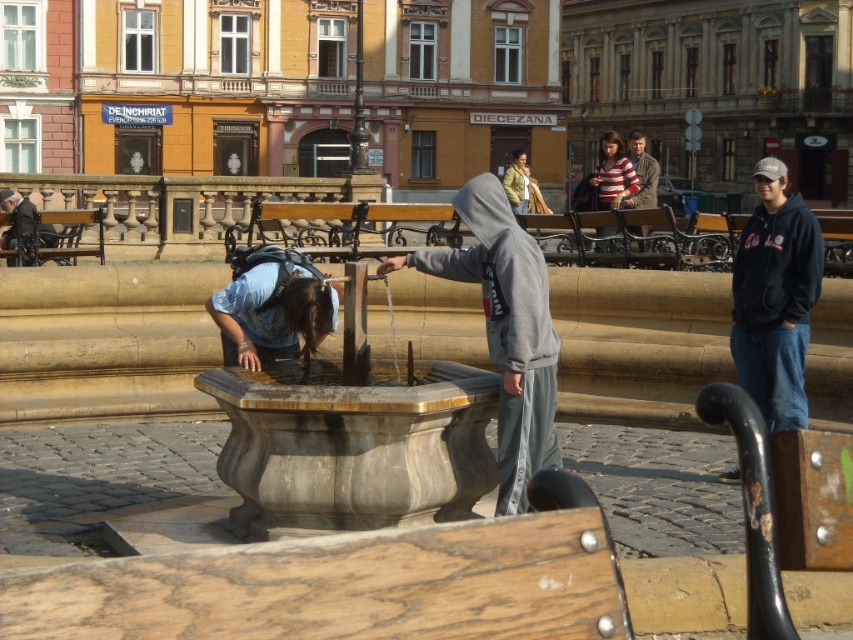
Can you confirm if dark blue hoodie at right is taller than striped cotton shirt at center?

No, dark blue hoodie at right is not taller than striped cotton shirt at center.

Is dark blue hoodie at right thinner than striped cotton shirt at center?

Correct, dark blue hoodie at right's width is less than striped cotton shirt at center's.

Between point (740, 381) and point (621, 147), which one is positioned in front?

Point (740, 381)

The width and height of the screenshot is (853, 640). In order to click on dark blue hoodie at right in this screenshot , I will do `click(775, 298)`.

Who is lower down, striped cotton shirt at center or striped sweater at center?

striped sweater at center is below.

The width and height of the screenshot is (853, 640). In order to click on striped cotton shirt at center in this screenshot , I will do `click(612, 173)`.

Find the location of a particular element. striped cotton shirt at center is located at coordinates (612, 173).

Between gray hoodie at center and dark blue hoodie at right, which one has more height?

dark blue hoodie at right is taller.

Which is behind, point (515, 355) or point (737, 472)?

The point (737, 472) is more distant.

Describe the element at coordinates (506, 330) in the screenshot. The height and width of the screenshot is (640, 853). I see `gray hoodie at center` at that location.

Image resolution: width=853 pixels, height=640 pixels. What are the coordinates of `gray hoodie at center` in the screenshot? It's located at (506, 330).